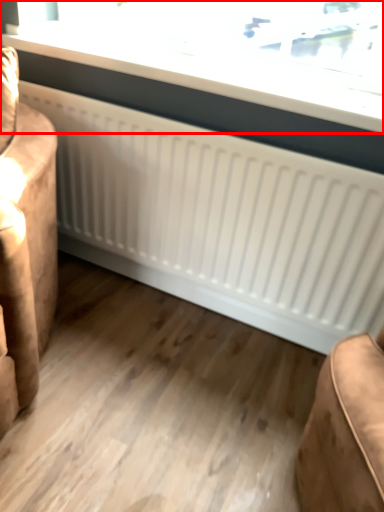
Question: From the image's perspective, what is the correct spatial positioning of window (annotated by the red box) in reference to furniture?

Choices:
 (A) above
 (B) below

Answer: (A)